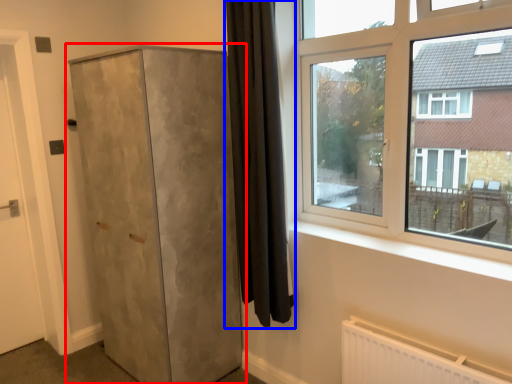
Question: Which object appears closest to the camera in this image, cupboard (highlighted by a red box) or curtain (highlighted by a blue box)?

Choices:
 (A) cupboard
 (B) curtain

Answer: (B)